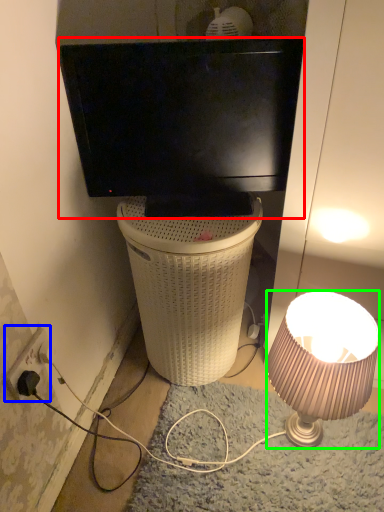
Question: Which object is the closest to the television (highlighted by a red box)? Choose among these: power outlet (highlighted by a blue box) or lamp (highlighted by a green box).

Choices:
 (A) power outlet
 (B) lamp

Answer: (B)